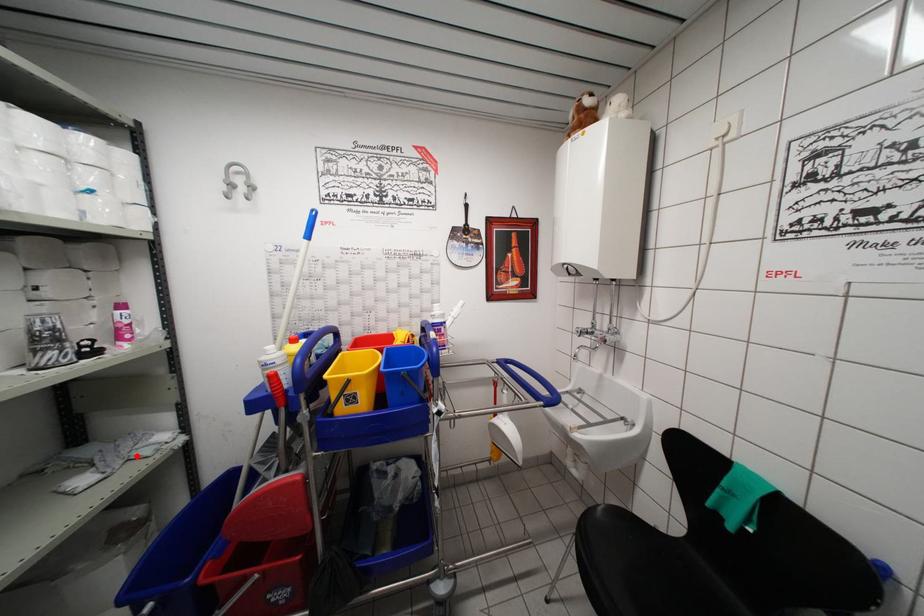
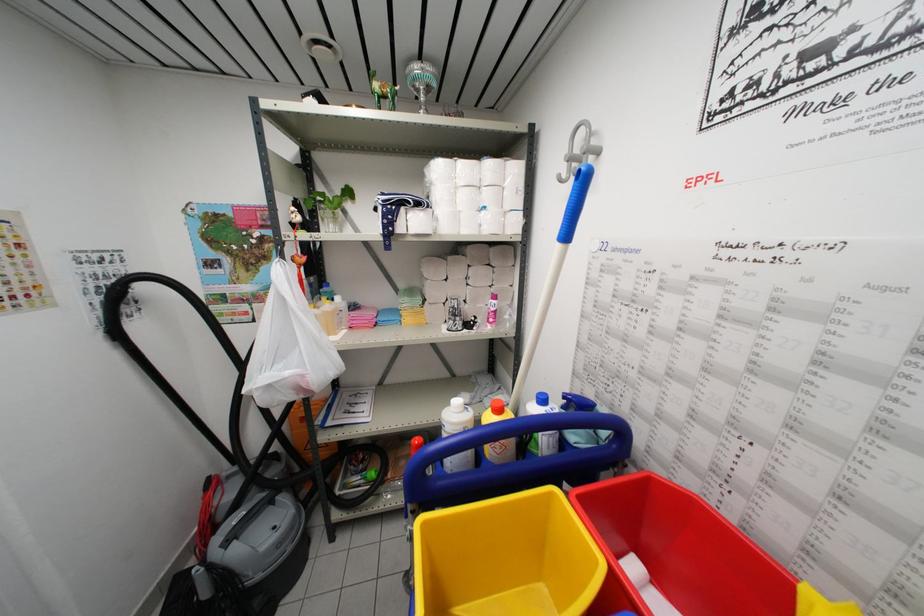
The point at the highlighted location is marked in the first image. Where is the corresponding point in the second image?

(490, 402)